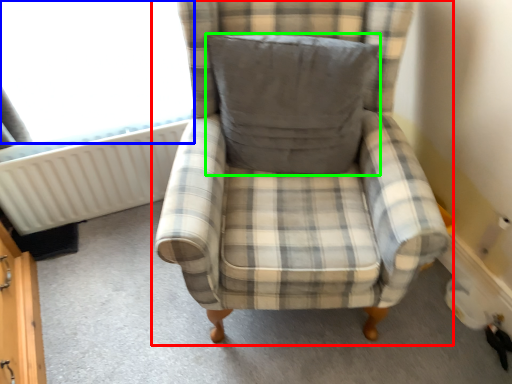
Question: Which object is positioned farthest from chair (highlighted by a red box)? Select from window screen (highlighted by a blue box) and pillow (highlighted by a green box).

Choices:
 (A) window screen
 (B) pillow

Answer: (A)